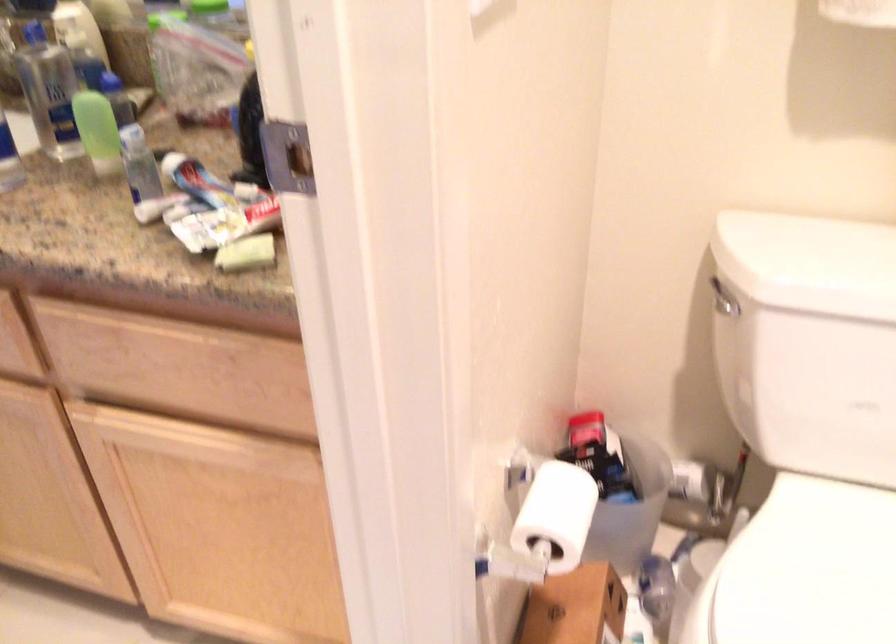
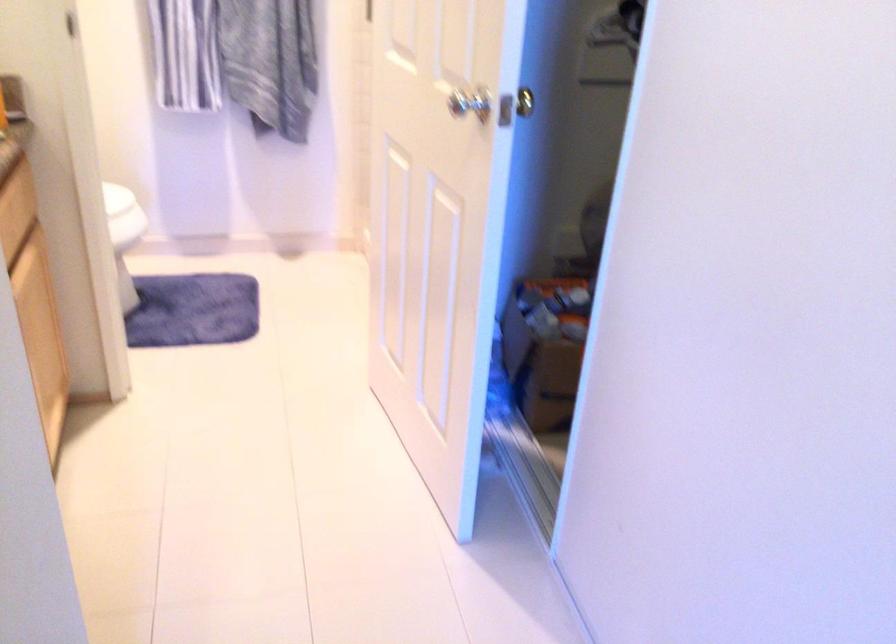
In the second image, find the point that corresponds to [92,335] in the first image.

(12, 229)